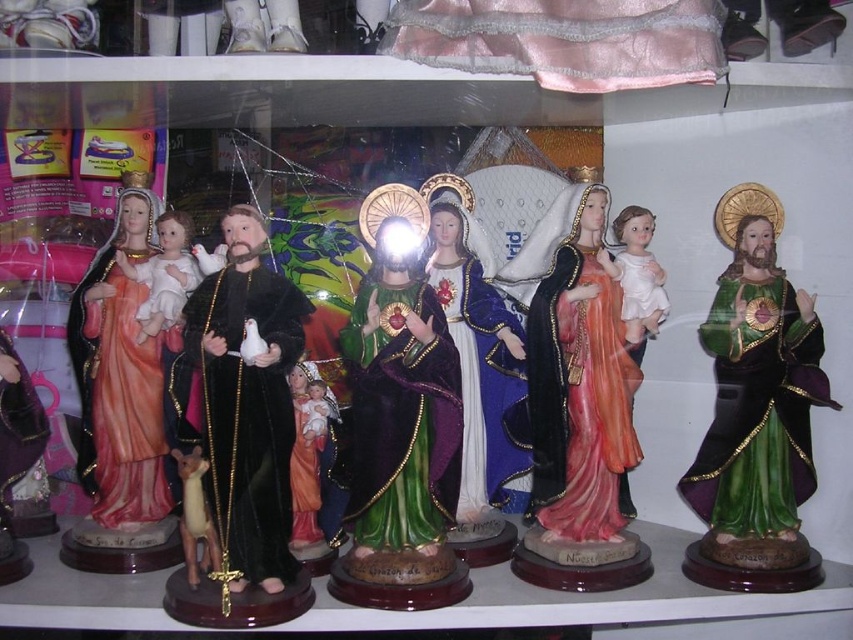
From the picture: Who is shorter, matte orange fabric statue at center or white glossy baby doll at center?

white glossy baby doll at center is shorter.

Can you confirm if matte orange fabric statue at center is positioned to the left of white glossy baby doll at center?

Indeed, matte orange fabric statue at center is positioned on the left side of white glossy baby doll at center.

Does point (540, 288) come closer to viewer compared to point (653, 291)?

Yes, it is.

I want to click on matte orange fabric statue at center, so tap(577, 374).

Describe the element at coordinates (120, 372) in the screenshot. Image resolution: width=853 pixels, height=640 pixels. I see `matte porcelain doll at left` at that location.

Between point (131, 280) and point (477, 275), which one is positioned behind?

Point (477, 275)

What do you see at coordinates (120, 372) in the screenshot? The height and width of the screenshot is (640, 853). I see `matte porcelain doll at left` at bounding box center [120, 372].

Where is `matte porcelain doll at left`? matte porcelain doll at left is located at coordinates (120, 372).

Who is lower down, green glossy statue at center or matte porcelain doll at left?

Positioned lower is green glossy statue at center.

Which of these two, green glossy statue at center or matte porcelain doll at left, stands shorter?

With less height is green glossy statue at center.

Find the location of a particular element. green glossy statue at center is located at coordinates (399, 387).